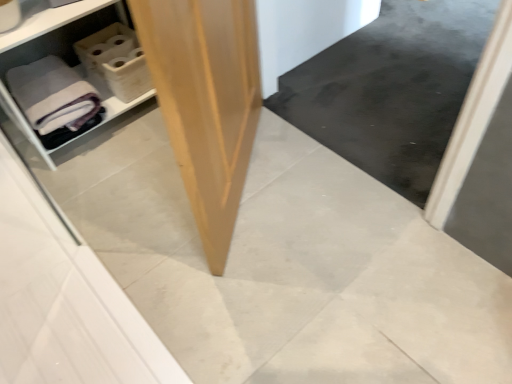
Question: Considering the relative sizes of white plastic shelf at left and light brown plywood at center in the image provided, is white plastic shelf at left wider than light brown plywood at center?

Choices:
 (A) no
 (B) yes

Answer: (B)

Question: From a real-world perspective, is white plastic shelf at left positioned over light brown plywood at center based on gravity?

Choices:
 (A) no
 (B) yes

Answer: (A)

Question: Could you tell me if white plastic shelf at left is turned towards light brown plywood at center?

Choices:
 (A) no
 (B) yes

Answer: (B)

Question: Does white plastic shelf at left have a smaller size compared to light brown plywood at center?

Choices:
 (A) yes
 (B) no

Answer: (B)

Question: Can you confirm if white plastic shelf at left is shorter than light brown plywood at center?

Choices:
 (A) yes
 (B) no

Answer: (A)

Question: Based on their positions, is gray matte bath towel at left located to the left or right of light brown plywood at center?

Choices:
 (A) left
 (B) right

Answer: (A)

Question: Is gray matte bath towel at left taller or shorter than light brown plywood at center?

Choices:
 (A) short
 (B) tall

Answer: (A)

Question: Considering the positions of gray matte bath towel at left and light brown plywood at center in the image, is gray matte bath towel at left bigger or smaller than light brown plywood at center?

Choices:
 (A) small
 (B) big

Answer: (A)

Question: From the image's perspective, is gray matte bath towel at left located above or below light brown plywood at center?

Choices:
 (A) below
 (B) above

Answer: (B)

Question: From a real-world perspective, is gray matte bath towel at left positioned above or below white plastic shelf at left?

Choices:
 (A) above
 (B) below

Answer: (B)

Question: Looking at their shapes, would you say gray matte bath towel at left is wider or thinner than white plastic shelf at left?

Choices:
 (A) wide
 (B) thin

Answer: (A)

Question: Which is correct: gray matte bath towel at left is inside white plastic shelf at left, or outside of it?

Choices:
 (A) inside
 (B) outside

Answer: (A)

Question: Considering the relative positions of gray matte bath towel at left and white plastic shelf at left in the image provided, is gray matte bath towel at left to the left or to the right of white plastic shelf at left?

Choices:
 (A) right
 (B) left

Answer: (B)

Question: In terms of width, does white plastic shelf at left look wider or thinner when compared to light brown plywood at center?

Choices:
 (A) thin
 (B) wide

Answer: (B)

Question: Which is correct: white plastic shelf at left is inside light brown plywood at center, or outside of it?

Choices:
 (A) outside
 (B) inside

Answer: (A)